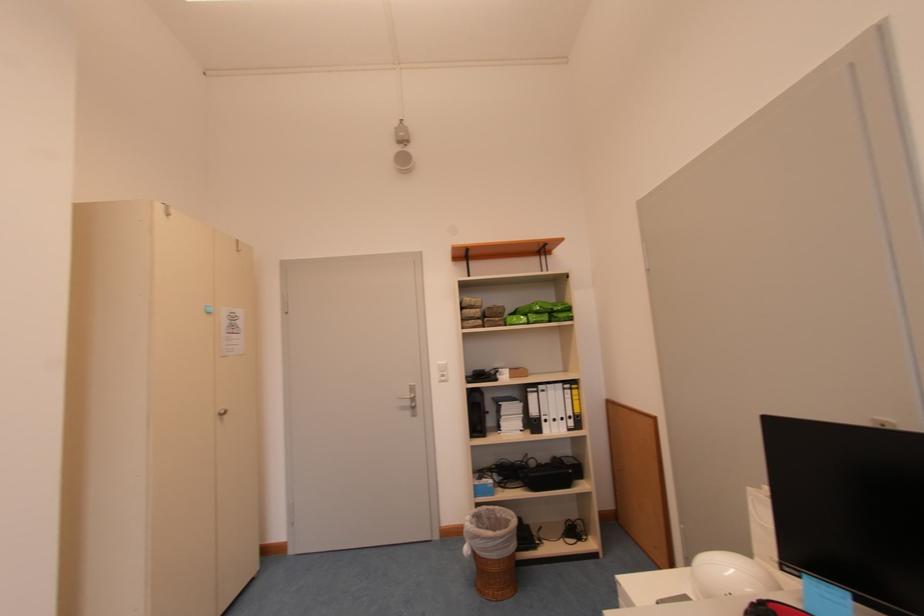
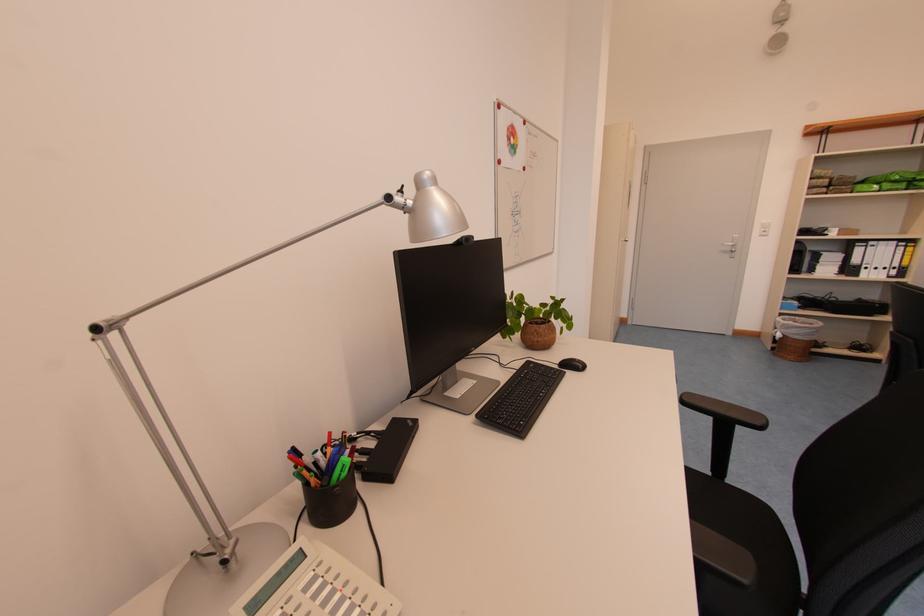
Locate, in the second image, the point that corresponds to pixel 504 509 in the first image.

(805, 321)